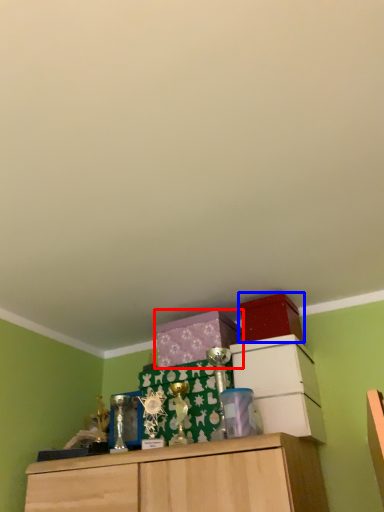
Question: Which object appears farthest to the camera in this image, cabinetry (highlighted by a red box) or storage box (highlighted by a blue box)?

Choices:
 (A) cabinetry
 (B) storage box

Answer: (A)